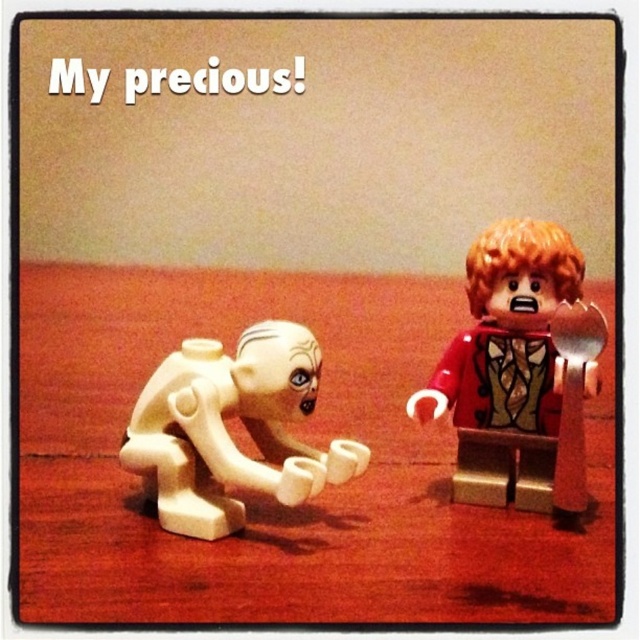
Question: Does wooden table at center appear under reddish-brown fabric vest at right?

Choices:
 (A) no
 (B) yes

Answer: (A)

Question: Does wooden table at center come in front of white matte figure at lower left?

Choices:
 (A) no
 (B) yes

Answer: (B)

Question: Which point appears farthest from the camera in this image?

Choices:
 (A) (518, 228)
 (B) (61, 390)

Answer: (B)

Question: Which is nearer to the reddish-brown fabric vest at right?

Choices:
 (A) wooden table at center
 (B) white matte figure at lower left

Answer: (A)

Question: Which point appears closest to the camera in this image?

Choices:
 (A) (300, 518)
 (B) (184, 445)

Answer: (B)

Question: Where is reddish-brown fabric vest at right located in relation to white matte figure at lower left in the image?

Choices:
 (A) below
 (B) above

Answer: (B)